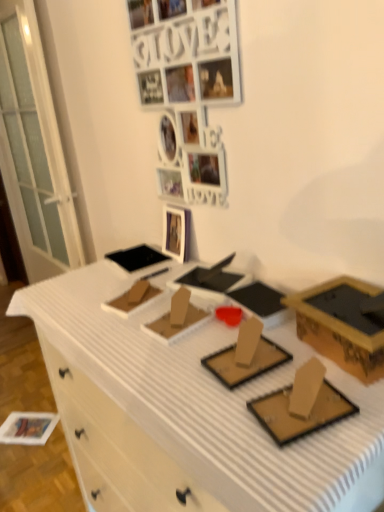
This screenshot has height=512, width=384. I want to click on white cardboard desk at center, so click(x=189, y=411).

Identify the location of white matte photo frame at upper center. This screenshot has height=512, width=384. [187, 89].

Is point (373, 365) closer or farther from the camera than point (66, 396)?

Clearly, point (373, 365) is closer to the camera than point (66, 396).

Is white matte drawer at lower left at the back of gold cardboard box at right?

That's not correct — gold cardboard box at right is not looking away from white matte drawer at lower left.

From the picture: Are gold cardboard box at right and white matte drawer at lower left located far from each other?

gold cardboard box at right is actually quite close to white matte drawer at lower left.

Is white matte drawer at lower left wider or thinner than white cardboard desk at center?

Clearly, white matte drawer at lower left has more width compared to white cardboard desk at center.

Is white matte drawer at lower left aimed at white cardboard desk at center?

No, white matte drawer at lower left is not oriented towards white cardboard desk at center.

Considering the sizes of objects white matte drawer at lower left and white cardboard desk at center in the image provided, who is smaller, white matte drawer at lower left or white cardboard desk at center?

white matte drawer at lower left is smaller.

How different are the orientations of white matte drawer at lower left and white cardboard desk at center in degrees?

89.2 degrees.

Do you think white glossy picture frame at upper center is within white matte photo frame at upper center, or outside of it?

white glossy picture frame at upper center is not inside white matte photo frame at upper center, it's outside.

From a real-world perspective, who is located higher, white glossy picture frame at upper center or white matte photo frame at upper center?

white matte photo frame at upper center is physically above.

I want to click on art exhibition that is on the right side of white glossy picture frame at upper center, so click(x=187, y=89).

Considering the positions of points (87, 315) and (167, 219), is point (87, 315) closer to camera compared to point (167, 219)?

That is True.

From a real-world perspective, which object stands above the other?

white glossy picture frame at upper center.

Is white cardboard desk at center looking in the opposite direction of white glossy picture frame at upper center?

No, white cardboard desk at center's orientation is not away from white glossy picture frame at upper center.

Is white cardboard desk at center not within white glossy picture frame at upper center?

Yes, white cardboard desk at center is located beyond the bounds of white glossy picture frame at upper center.

How many degrees apart are the facing directions of white cardboard desk at center and gold cardboard box at right?

12.9 degrees.

Is white cardboard desk at center located outside gold cardboard box at right?

Indeed, white cardboard desk at center is completely outside gold cardboard box at right.

Is white cardboard desk at center positioned behind gold cardboard box at right?

No, white cardboard desk at center is in front of gold cardboard box at right.

Considering the relative positions of white cardboard desk at center and gold cardboard box at right in the image provided, is white cardboard desk at center to the left or to the right of gold cardboard box at right?

white cardboard desk at center is positioned on gold cardboard box at right's left side.

Is white cardboard desk at center bigger or smaller than white matte drawer at lower left?

white cardboard desk at center is bigger than white matte drawer at lower left.

From the image's perspective, who appears lower, white cardboard desk at center or white matte drawer at lower left?

white matte drawer at lower left.

The height and width of the screenshot is (512, 384). Identify the location of desk that appears in front of the white matte drawer at lower left. (189, 411).

This screenshot has width=384, height=512. In the image, there is a white matte drawer at lower left. In order to click on picture frame above it (from the image's perspective) in this screenshot , I will do `click(174, 233)`.

Does white glossy picture frame at upper center turn towards white matte drawer at lower left?

No, white glossy picture frame at upper center is not facing towards white matte drawer at lower left.

Is white glossy picture frame at upper center further to camera compared to white matte drawer at lower left?

No, it is in front of white matte drawer at lower left.

Does point (168, 226) lie in front of point (174, 488)?

No, (168, 226) is behind (174, 488).

Identify the location of drawer lying on the left of gold cardboard box at right. (116, 449).

The width and height of the screenshot is (384, 512). I want to click on desk on the right side of white matte drawer at lower left, so click(x=189, y=411).

Which object lies nearer to the anchor point white cardboard desk at center, gold cardboard box at right or white matte photo frame at upper center?

The object closer to white cardboard desk at center is gold cardboard box at right.

Looking at this image, when comparing their distances from white cardboard desk at center, does white matte drawer at lower left or white matte photo frame at upper center seem further?

white matte photo frame at upper center is further to white cardboard desk at center.

When comparing their distances from white glossy picture frame at upper center, does white matte drawer at lower left or white cardboard desk at center seem further?

white matte drawer at lower left lies further to white glossy picture frame at upper center than the other object.

Estimate the real-world distances between objects in this image. Which object is further from white matte photo frame at upper center, white glossy picture frame at upper center or white cardboard desk at center?

white cardboard desk at center lies further to white matte photo frame at upper center than the other object.

Based on their spatial positions, is gold cardboard box at right or white matte photo frame at upper center further from white glossy picture frame at upper center?

gold cardboard box at right.

Considering their positions, is white matte photo frame at upper center positioned further to white cardboard desk at center than white matte drawer at lower left?

white matte photo frame at upper center.

Looking at this image, based on their spatial positions, is white matte drawer at lower left or white cardboard desk at center further from gold cardboard box at right?

Based on the image, white matte drawer at lower left appears to be further to gold cardboard box at right.

Looking at the image, which one is located further to white matte photo frame at upper center, white cardboard desk at center or white matte drawer at lower left?

white matte drawer at lower left.

Where is `box between white matte photo frame at upper center and white matte drawer at lower left in the vertical direction`? The width and height of the screenshot is (384, 512). box between white matte photo frame at upper center and white matte drawer at lower left in the vertical direction is located at coordinates 341,326.

The image size is (384, 512). Find the location of `desk that lies between white matte photo frame at upper center and white matte drawer at lower left from top to bottom`. desk that lies between white matte photo frame at upper center and white matte drawer at lower left from top to bottom is located at coordinates (189, 411).

Identify the location of box that lies between white matte photo frame at upper center and white cardboard desk at center from top to bottom. (341, 326).

The height and width of the screenshot is (512, 384). I want to click on picture frame between white matte photo frame at upper center and white matte drawer at lower left in the up-down direction, so click(174, 233).